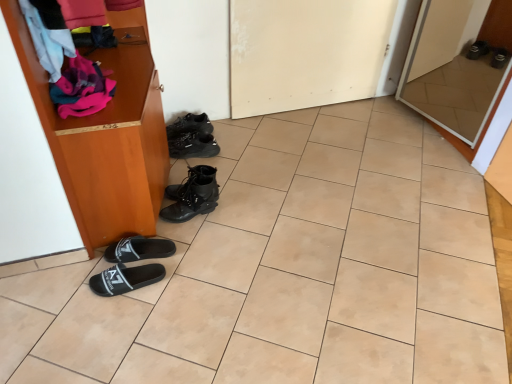
I want to click on free point to the left of black fabric slipper at lower left, the fifth footwear in the back-to-front sequence, so click(75, 284).